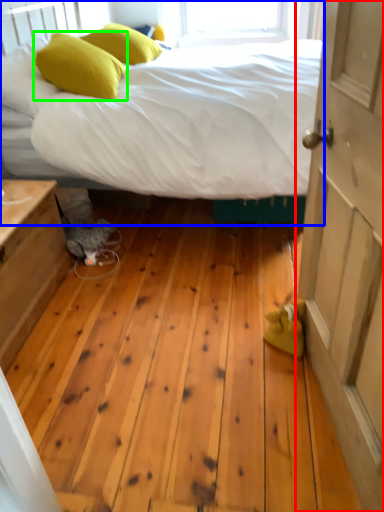
Question: Considering the real-world distances, which object is closest to door (highlighted by a red box)? bed (highlighted by a blue box) or pillow (highlighted by a green box).

Choices:
 (A) bed
 (B) pillow

Answer: (A)